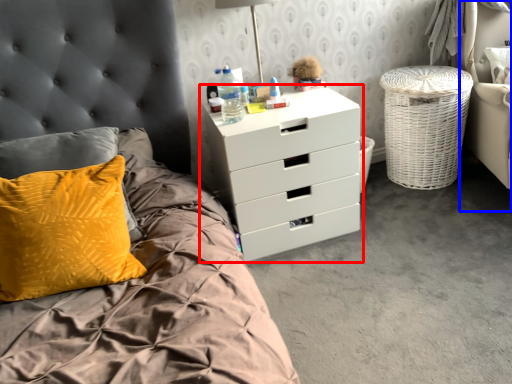
Question: Among these objects, which one is nearest to the camera, chest of drawers (highlighted by a red box) or armchair (highlighted by a blue box)?

Choices:
 (A) chest of drawers
 (B) armchair

Answer: (B)